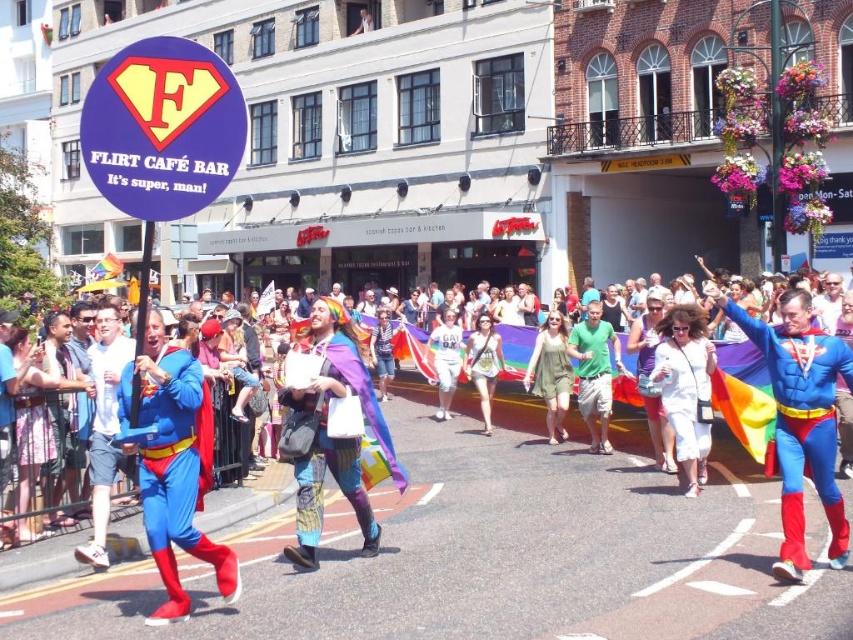
Who is taller, blue fabric superman costume at left or blue fabric costume at center?

blue fabric superman costume at left is taller.

Which is behind, point (160, 326) or point (117, 467)?

Positioned behind is point (117, 467).

Identify the location of blue fabric superman costume at left. Image resolution: width=853 pixels, height=640 pixels. (171, 467).

This screenshot has width=853, height=640. I want to click on blue fabric superman costume at left, so click(171, 467).

Is shiny blue spandex suit at center shorter than multicolored fabric cape at center?

In fact, shiny blue spandex suit at center may be taller than multicolored fabric cape at center.

Between point (827, 364) and point (305, 557), which one is positioned behind?

The point (305, 557) is behind.

Where is `shiny blue spandex suit at center`? The image size is (853, 640). shiny blue spandex suit at center is located at coordinates (801, 419).

Who is higher up, shiny blue costume at center or shiny blue spandex suit at center?

Positioned higher is shiny blue spandex suit at center.

At what (x,y) coordinates should I click in order to perform the action: click on shiny blue costume at center. Please return your answer as a coordinate pair (x, y). Looking at the image, I should click on (480, 548).

Where is `shiny blue costume at center`? shiny blue costume at center is located at coordinates (480, 548).